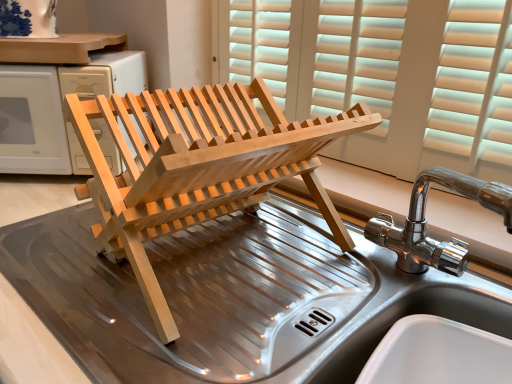
At what (x,y) coordinates should I click in order to perform the action: click on free point below stainless steel sink at center (from a real-world perspective). Please return your answer as a coordinate pair (x, y). Looking at the image, I should click on (409, 287).